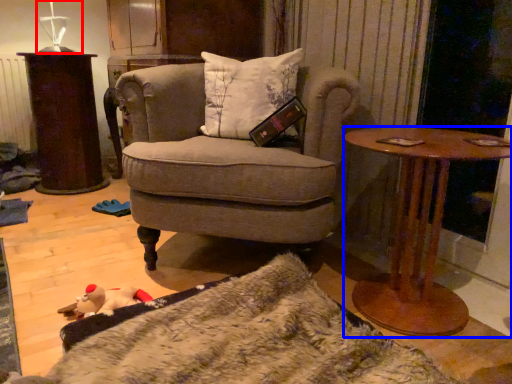
Question: Which point is closer to the camera, table lamp (highlighted by a red box) or desk (highlighted by a blue box)?

Choices:
 (A) table lamp
 (B) desk

Answer: (B)